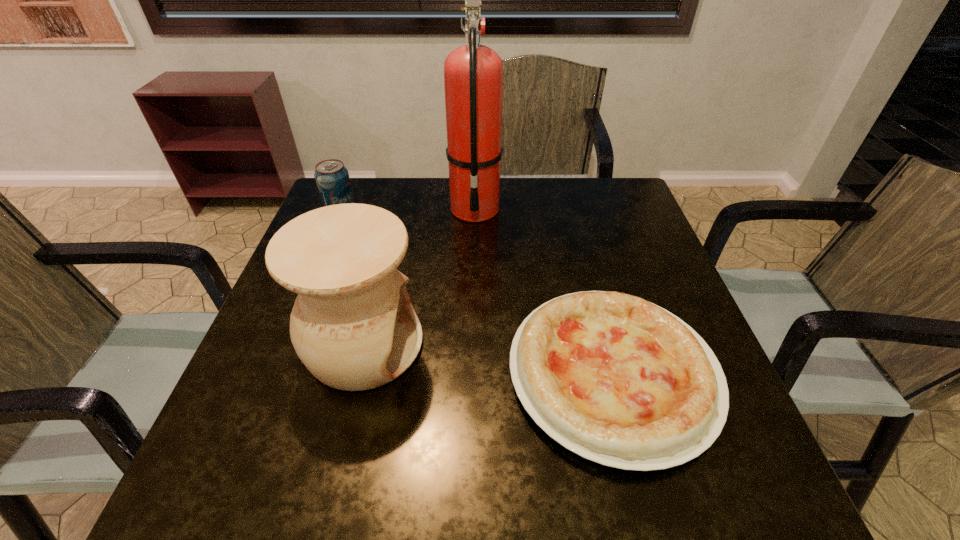
Find the location of a particular element. object present at the near edge is located at coordinates (618, 380).

The height and width of the screenshot is (540, 960). What are the coordinates of `pottery positioned at the left edge` in the screenshot? It's located at (353, 326).

Locate an element on the screen. This screenshot has width=960, height=540. pop soda that is at the left edge is located at coordinates (332, 178).

Locate an element on the screen. The image size is (960, 540). object present at the right edge is located at coordinates (618, 380).

You are a GUI agent. You are given a task and a screenshot of the screen. Output one action in this format:
    pyautogui.click(x=<x>, y=<y>)
    Task: Click on the object that is positioned at the far left corner
    
    Given the screenshot: What is the action you would take?
    pyautogui.click(x=332, y=178)

Identify the location of object situated at the near right corner. Image resolution: width=960 pixels, height=540 pixels. pyautogui.click(x=618, y=380).

At what (x,y) coordinates should I click in order to perform the action: click on free location at the far edge of the desktop. Please return your answer as a coordinate pair (x, y). The width and height of the screenshot is (960, 540). Looking at the image, I should click on (443, 211).

The width and height of the screenshot is (960, 540). Identify the location of vacant space at the near edge of the desktop. (442, 450).

Locate an element on the screen. Image resolution: width=960 pixels, height=540 pixels. vacant region at the left edge is located at coordinates (291, 429).

Find the location of a particular element. free space at the right edge of the desktop is located at coordinates (616, 251).